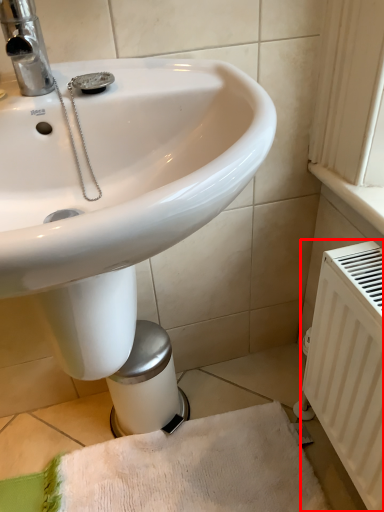
Question: Observing the image, what is the correct spatial positioning of radiator (annotated by the red box) in reference to bath towel?

Choices:
 (A) left
 (B) right

Answer: (B)